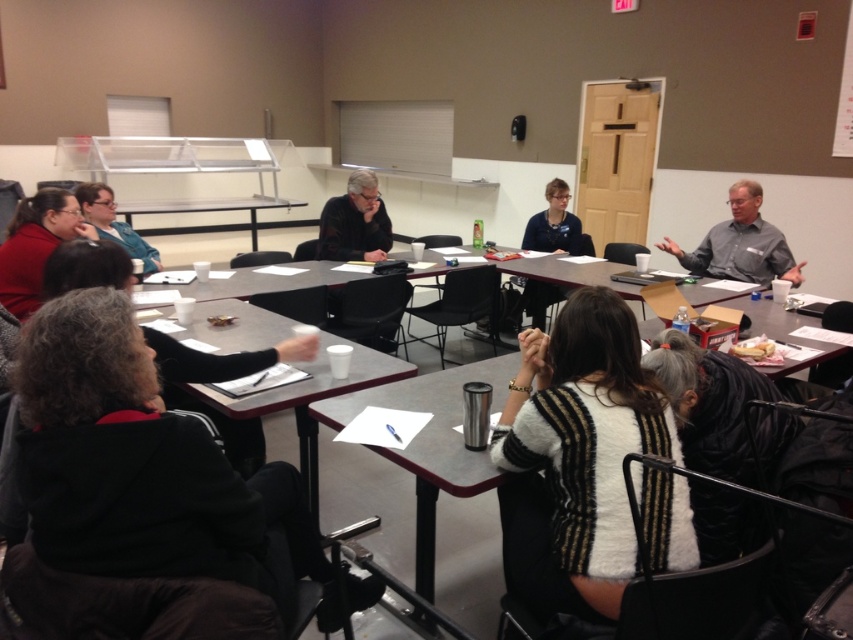
Does matte black table at center appear under matte black jacket at left?

Yes, matte black table at center is below matte black jacket at left.

What do you see at coordinates (308, 400) in the screenshot?
I see `matte black table at center` at bounding box center [308, 400].

Where is `matte black table at center`? Image resolution: width=853 pixels, height=640 pixels. matte black table at center is located at coordinates (308, 400).

Is white fuzzy sweater at center below matte black jacket at left?

Indeed, white fuzzy sweater at center is positioned under matte black jacket at left.

Can you confirm if white fuzzy sweater at center is taller than matte black jacket at left?

Yes, white fuzzy sweater at center is taller than matte black jacket at left.

Does point (570, 369) come closer to viewer compared to point (109, 205)?

Yes, point (570, 369) is closer to viewer.

You are a GUI agent. You are given a task and a screenshot of the screen. Output one action in this format:
    pyautogui.click(x=<x>, y=<y>)
    Task: Click on the white fuzzy sweater at center
    This screenshot has height=640, width=853.
    Given the screenshot: What is the action you would take?
    pyautogui.click(x=576, y=458)

Which is above, white fuzzy sweater at center or matte black table at center?

matte black table at center is above.

Measure the distance between point (537, 563) and camera.

Point (537, 563) and camera are 1.64 meters apart from each other.

Which is in front, point (608, 515) or point (193, 336)?

Point (608, 515)

At what (x,y) coordinates should I click in order to perform the action: click on white fuzzy sweater at center. Please return your answer as a coordinate pair (x, y). The width and height of the screenshot is (853, 640). Looking at the image, I should click on (576, 458).